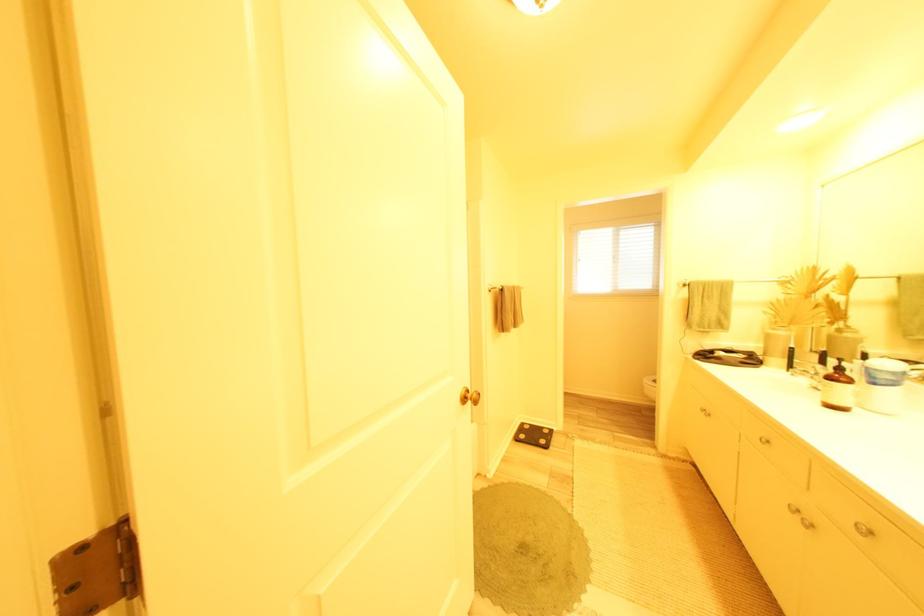
Identify the location of green bottle pump. This screenshot has width=924, height=616. (837, 389).